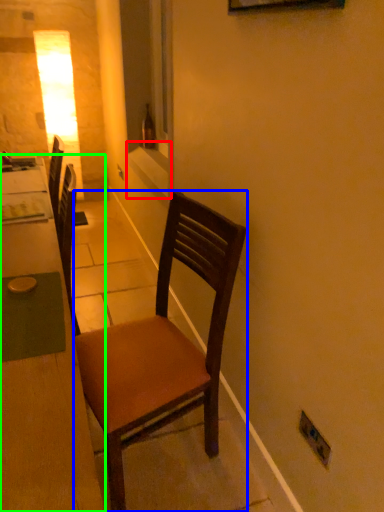
Question: Estimate the real-world distances between objects in this image. Which object is farther from window sill (highlighted by a red box), chair (highlighted by a blue box) or desk (highlighted by a green box)?

Choices:
 (A) chair
 (B) desk

Answer: (A)